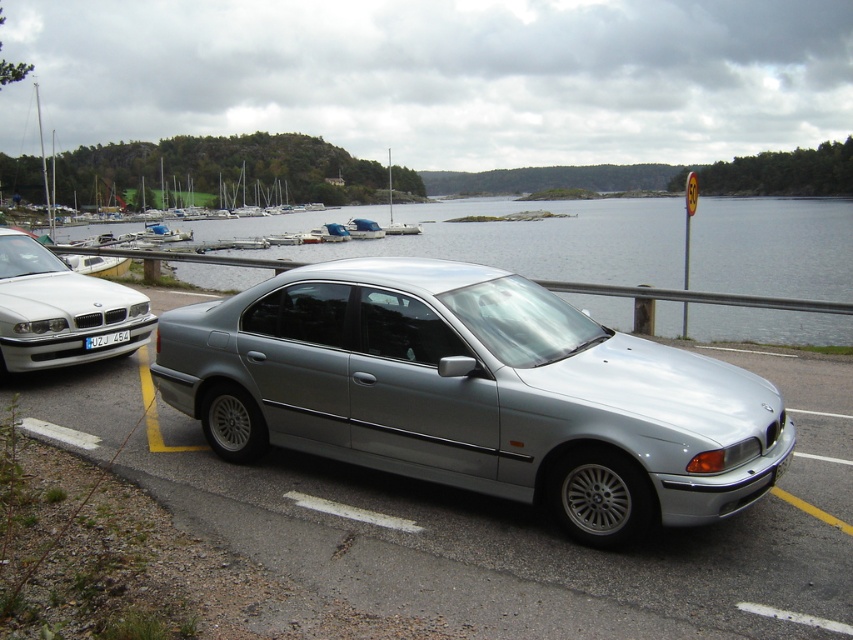
Question: Estimate the real-world distances between objects in this image. Which object is farther from the satin silver car at center?

Choices:
 (A) white glossy boat at center
 (B) white plastic license plate at center
 (C) silver metallic sedan at left
 (D) silver metallic water at center

Answer: (A)

Question: Which point appears farthest from the camera in this image?

Choices:
 (A) (102, 333)
 (B) (363, 234)
 (C) (378, 456)
 (D) (65, 310)

Answer: (B)

Question: Which object appears closest to the camera in this image?

Choices:
 (A) white plastic license plate at center
 (B) silver metallic sedan at left

Answer: (B)

Question: Is satin silver car at center to the right of white glossy boat at center from the viewer's perspective?

Choices:
 (A) no
 (B) yes

Answer: (B)

Question: Can you confirm if silver metallic water at center is thinner than white glossy boat at center?

Choices:
 (A) yes
 (B) no

Answer: (B)

Question: Can you confirm if white glossy boat at center is thinner than white plastic license plate at center?

Choices:
 (A) no
 (B) yes

Answer: (A)